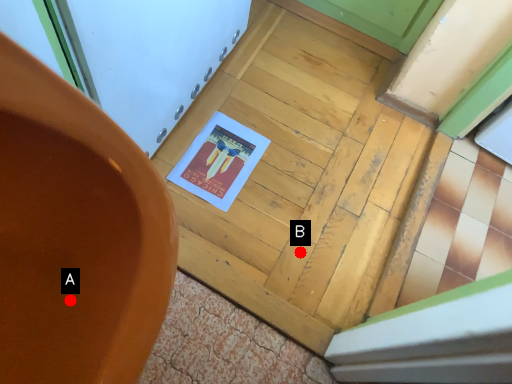
Question: Two points are circled on the image, labeled by A and B beside each circle. Which point is closer to the camera?

Choices:
 (A) A is closer
 (B) B is closer

Answer: (A)